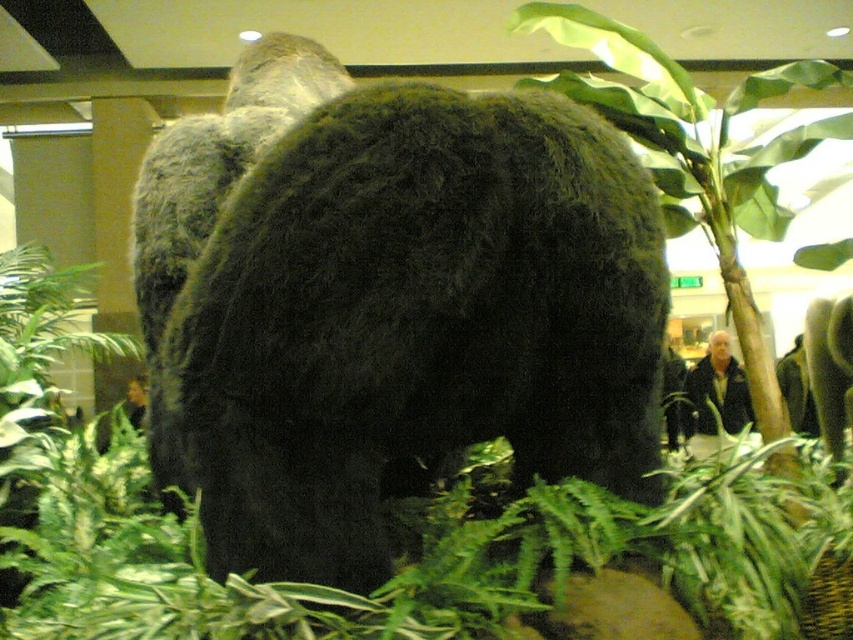
Question: Does black fuzzy bear at center appear under green leafy fern at center?

Choices:
 (A) no
 (B) yes

Answer: (B)

Question: Among these points, which one is nearest to the camera?

Choices:
 (A) (347, 236)
 (B) (703, 154)

Answer: (A)

Question: Can you confirm if black fuzzy bear at center is bigger than green leafy fern at center?

Choices:
 (A) no
 (B) yes

Answer: (A)

Question: Does black fuzzy bear at center appear on the right side of green leafy fern at center?

Choices:
 (A) no
 (B) yes

Answer: (A)

Question: Among these points, which one is farthest from the camera?

Choices:
 (A) (473, 209)
 (B) (721, 156)

Answer: (B)